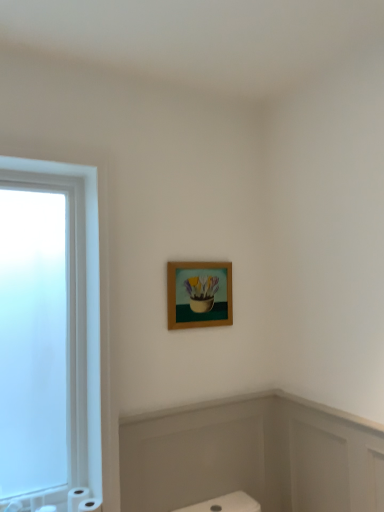
At what (x,y) coordinates should I click in order to perform the action: click on white matte toilet paper at lower left, the second toilet paper from the left. Please return your answer as a coordinate pair (x, y). The height and width of the screenshot is (512, 384). Looking at the image, I should click on (77, 497).

You are a GUI agent. You are given a task and a screenshot of the screen. Output one action in this format:
    pyautogui.click(x=<x>, y=<y>)
    Task: Click on the white matte bath at lower center
    This screenshot has height=512, width=384.
    Given the screenshot: What is the action you would take?
    [x=251, y=457]

What do you see at coordinates (90, 505) in the screenshot? I see `white matte toilet paper at lower left, positioned as the first toilet paper in right-to-left order` at bounding box center [90, 505].

Locate an element on the screen. white matte toilet paper at lower left, which is counted as the third toilet paper, starting from the left is located at coordinates (90, 505).

Find the location of a particular element. Image resolution: width=384 pixels, height=512 pixels. white matte toilet paper at lower left, the 3th toilet paper viewed from the right is located at coordinates (47, 508).

From the white matte bath at lower center, count the 2nd toilet paper to the left and point to it. Please provide its 2D coordinates.

[(77, 497)]

From the picture: Which is farther, (x=139, y=459) or (x=69, y=501)?

The point (x=69, y=501) is farther.

Does white matte bath at lower center touch white matte toilet paper at lower left, placed as the second toilet paper when sorted from right to left?

white matte bath at lower center is not next to white matte toilet paper at lower left, placed as the second toilet paper when sorted from right to left, and they're not touching.

Based on their sizes in the image, would you say white matte bath at lower center is bigger or smaller than white matte toilet paper at lower left, placed as the second toilet paper when sorted from right to left?

white matte bath at lower center is bigger than white matte toilet paper at lower left, placed as the second toilet paper when sorted from right to left.

Does wooden frame at upper center have a greater height compared to white matte toilet paper at lower left, which is counted as the third toilet paper, starting from the left?

Correct, wooden frame at upper center is much taller as white matte toilet paper at lower left, which is counted as the third toilet paper, starting from the left.

From the picture: Between wooden frame at upper center and white matte toilet paper at lower left, positioned as the first toilet paper in right-to-left order, which one appears on the left side from the viewer's perspective?

From the viewer's perspective, white matte toilet paper at lower left, positioned as the first toilet paper in right-to-left order, appears more on the left side.

Who is smaller, wooden frame at upper center or white matte toilet paper at lower left, which is counted as the third toilet paper, starting from the left?

With smaller size is white matte toilet paper at lower left, which is counted as the third toilet paper, starting from the left.

There is a white matte toilet paper at lower left, positioned as the first toilet paper in right-to-left order. Where is `picture frame above it (from a real-world perspective)`? picture frame above it (from a real-world perspective) is located at coordinates (199, 294).

Considering their positions, is white matte toilet paper at lower left, positioned as the first toilet paper in right-to-left order, located in front of or behind white matte toilet paper at lower left, the second toilet paper from the left?

Visually, white matte toilet paper at lower left, positioned as the first toilet paper in right-to-left order, is located in front of white matte toilet paper at lower left, the second toilet paper from the left.

Between point (81, 509) and point (74, 508), which one is positioned behind?

The point (74, 508) is farther.

From a real-world perspective, is white matte toilet paper at lower left, positioned as the first toilet paper in right-to-left order, located beneath white matte toilet paper at lower left, placed as the second toilet paper when sorted from right to left?

Actually, white matte toilet paper at lower left, positioned as the first toilet paper in right-to-left order, is physically above white matte toilet paper at lower left, placed as the second toilet paper when sorted from right to left, in the real world.

From the image's perspective, is white matte toilet paper at lower left, which ranks as the 1th toilet paper in left-to-right order, on top of wooden frame at upper center?

Incorrect, from the image's perspective, white matte toilet paper at lower left, which ranks as the 1th toilet paper in left-to-right order, is lower than wooden frame at upper center.

Between white matte toilet paper at lower left, the 3th toilet paper viewed from the right, and wooden frame at upper center, which one is positioned in front?

white matte toilet paper at lower left, the 3th toilet paper viewed from the right, is closer to the camera.

Do you think white matte toilet paper at lower left, the 3th toilet paper viewed from the right, is within wooden frame at upper center, or outside of it?

white matte toilet paper at lower left, the 3th toilet paper viewed from the right, is outside wooden frame at upper center.

Can you tell me how much white matte toilet paper at lower left, which ranks as the 1th toilet paper in left-to-right order, and wooden frame at upper center differ in facing direction?

A: The angular difference between white matte toilet paper at lower left, which ranks as the 1th toilet paper in left-to-right order, and wooden frame at upper center is 0.0589 degrees.

Which object is further away from the camera, white matte toilet paper at lower left, placed as the second toilet paper when sorted from right to left, or wooden frame at upper center?

wooden frame at upper center.

Between point (73, 507) and point (216, 309), which one is positioned in front?

Positioned in front is point (73, 507).

Is white matte toilet paper at lower left, the second toilet paper from the left, taller than wooden frame at upper center?

In fact, white matte toilet paper at lower left, the second toilet paper from the left, may be shorter than wooden frame at upper center.

Which of these two, white matte toilet paper at lower left, placed as the second toilet paper when sorted from right to left, or wooden frame at upper center, is wider?

white matte toilet paper at lower left, placed as the second toilet paper when sorted from right to left.

Does white matte toilet paper at lower left, placed as the second toilet paper when sorted from right to left, have a lesser height compared to white matte toilet paper at lower left, which ranks as the 1th toilet paper in left-to-right order?

No, white matte toilet paper at lower left, placed as the second toilet paper when sorted from right to left, is not shorter than white matte toilet paper at lower left, which ranks as the 1th toilet paper in left-to-right order.

From the image's perspective, which one is positioned higher, white matte toilet paper at lower left, placed as the second toilet paper when sorted from right to left, or white matte toilet paper at lower left, the 3th toilet paper viewed from the right?

white matte toilet paper at lower left, placed as the second toilet paper when sorted from right to left.

Which object is further away from the camera, white matte toilet paper at lower left, the second toilet paper from the left, or white matte toilet paper at lower left, which ranks as the 1th toilet paper in left-to-right order?

white matte toilet paper at lower left, the second toilet paper from the left.

Is white matte toilet paper at lower left, the 3th toilet paper viewed from the right, turned away from white matte toilet paper at lower left, the second toilet paper from the left?

That's not correct — white matte toilet paper at lower left, the 3th toilet paper viewed from the right, is not looking away from white matte toilet paper at lower left, the second toilet paper from the left.

Considering the sizes of white matte toilet paper at lower left, which ranks as the 1th toilet paper in left-to-right order, and white matte toilet paper at lower left, placed as the second toilet paper when sorted from right to left, in the image, is white matte toilet paper at lower left, which ranks as the 1th toilet paper in left-to-right order, wider or thinner than white matte toilet paper at lower left, placed as the second toilet paper when sorted from right to left,?

white matte toilet paper at lower left, which ranks as the 1th toilet paper in left-to-right order, is wider than white matte toilet paper at lower left, placed as the second toilet paper when sorted from right to left.

At what (x,y) coordinates should I click in order to perform the action: click on the 1st toilet paper positioned above the white matte toilet paper at lower left, the 3th toilet paper viewed from the right (from a real-world perspective). Please return your answer as a coordinate pair (x, y). Looking at the image, I should click on (77, 497).

Which of these two, white matte toilet paper at lower left, which ranks as the 1th toilet paper in left-to-right order, or white matte toilet paper at lower left, the second toilet paper from the left, is smaller?

Smaller between the two is white matte toilet paper at lower left, which ranks as the 1th toilet paper in left-to-right order.

At what (x,y) coordinates should I click in order to perform the action: click on toilet paper behind the white matte bath at lower center. Please return your answer as a coordinate pair (x, y). Looking at the image, I should click on 77,497.

In order to click on the 1st toilet paper to the left of the wooden frame at upper center, counting from the anchor's position in this screenshot , I will do `click(90, 505)`.

Considering their positions, is white matte toilet paper at lower left, the 3th toilet paper viewed from the right, positioned closer to wooden frame at upper center than white matte toilet paper at lower left, placed as the second toilet paper when sorted from right to left?

white matte toilet paper at lower left, placed as the second toilet paper when sorted from right to left, lies closer to wooden frame at upper center than the other object.

Which object lies nearer to the anchor point white matte toilet paper at lower left, which ranks as the 1th toilet paper in left-to-right order, wooden frame at upper center or white matte toilet paper at lower left, placed as the second toilet paper when sorted from right to left?

Among the two, white matte toilet paper at lower left, placed as the second toilet paper when sorted from right to left, is located nearer to white matte toilet paper at lower left, which ranks as the 1th toilet paper in left-to-right order.

From the image, which object appears to be farther from white matte toilet paper at lower left, positioned as the first toilet paper in right-to-left order, wooden frame at upper center or white matte bath at lower center?

The object further to white matte toilet paper at lower left, positioned as the first toilet paper in right-to-left order, is wooden frame at upper center.

Estimate the real-world distances between objects in this image. Which object is closer to white matte toilet paper at lower left, positioned as the first toilet paper in right-to-left order, white matte bath at lower center or white matte toilet paper at lower left, placed as the second toilet paper when sorted from right to left?

Based on the image, white matte toilet paper at lower left, placed as the second toilet paper when sorted from right to left, appears to be nearer to white matte toilet paper at lower left, positioned as the first toilet paper in right-to-left order.

Based on their spatial positions, is wooden frame at upper center or white matte toilet paper at lower left, which is counted as the third toilet paper, starting from the left, further from white matte bath at lower center?

white matte toilet paper at lower left, which is counted as the third toilet paper, starting from the left, is further to white matte bath at lower center.

Looking at the image, which one is located further to white matte toilet paper at lower left, which ranks as the 1th toilet paper in left-to-right order, white matte toilet paper at lower left, the second toilet paper from the left, or wooden frame at upper center?

wooden frame at upper center is further to white matte toilet paper at lower left, which ranks as the 1th toilet paper in left-to-right order.

Estimate the real-world distances between objects in this image. Which object is further from wooden frame at upper center, white matte bath at lower center or white matte toilet paper at lower left, which is counted as the third toilet paper, starting from the left?

white matte toilet paper at lower left, which is counted as the third toilet paper, starting from the left, is positioned further to the anchor wooden frame at upper center.

When comparing their distances from wooden frame at upper center, does white matte toilet paper at lower left, which is counted as the third toilet paper, starting from the left, or white matte toilet paper at lower left, which ranks as the 1th toilet paper in left-to-right order, seem further?

white matte toilet paper at lower left, which ranks as the 1th toilet paper in left-to-right order, is positioned further to the anchor wooden frame at upper center.

Find the location of a particular element. The width and height of the screenshot is (384, 512). toilet paper between white matte toilet paper at lower left, the 3th toilet paper viewed from the right, and white matte toilet paper at lower left, which is counted as the third toilet paper, starting from the left, from left to right is located at coordinates (77, 497).

The height and width of the screenshot is (512, 384). Identify the location of toilet paper between wooden frame at upper center and white matte toilet paper at lower left, the second toilet paper from the left, in the up-down direction. (90, 505).

You are a GUI agent. You are given a task and a screenshot of the screen. Output one action in this format:
    pyautogui.click(x=<x>, y=<y>)
    Task: Click on the toilet paper between white matte toilet paper at lower left, placed as the second toilet paper when sorted from right to left, and white matte bath at lower center
    Image resolution: width=384 pixels, height=512 pixels.
    Given the screenshot: What is the action you would take?
    pyautogui.click(x=90, y=505)

Locate an element on the screen. bath between wooden frame at upper center and white matte toilet paper at lower left, which is counted as the third toilet paper, starting from the left, in the up-down direction is located at coordinates (251, 457).